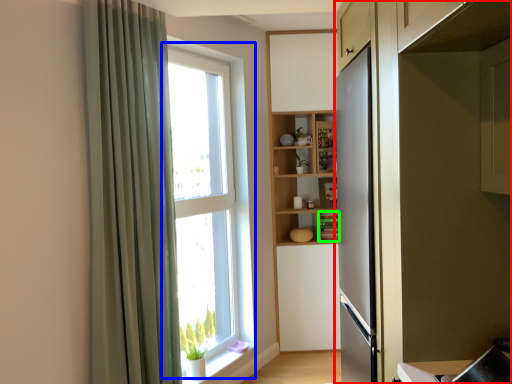
Question: Which is nearer to the cabinetry (highlighted by a red box)? window (highlighted by a blue box) or cabinet (highlighted by a green box).

Choices:
 (A) window
 (B) cabinet

Answer: (A)